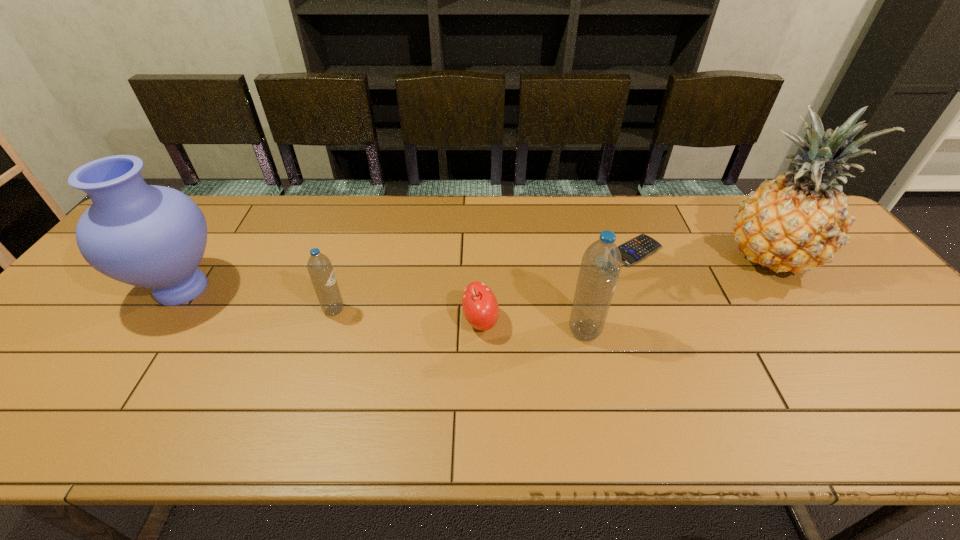
Where is `the shortest object`? Image resolution: width=960 pixels, height=540 pixels. the shortest object is located at coordinates tap(638, 248).

Find the location of a particular element. This screenshot has height=540, width=960. blank space located 0.070m on the back of the shorter water bottle is located at coordinates (343, 284).

Identify the location of free space located on the back of the third tallest object. The image size is (960, 540). (569, 262).

Locate an element on the screen. vacant space located 0.270m on the right of the second tallest object is located at coordinates (330, 288).

Locate an element on the screen. The width and height of the screenshot is (960, 540). vacant space located 0.280m on the front of the pineapple is located at coordinates (856, 382).

In order to click on free space located on the left of the second shortest object in this screenshot , I will do `click(378, 322)`.

Find the location of a particular element. Image resolution: width=960 pixels, height=540 pixels. vacant space situated on the left of the shortest object is located at coordinates (489, 251).

Where is `pineapple present at the far edge`? pineapple present at the far edge is located at coordinates (796, 222).

I want to click on calculator positioned at the far edge, so click(638, 248).

Where is `object present at the left edge`? The height and width of the screenshot is (540, 960). object present at the left edge is located at coordinates (149, 236).